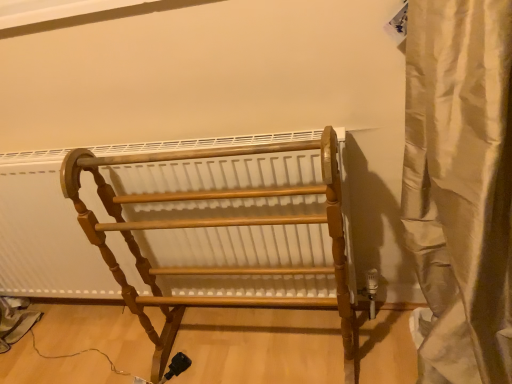
Question: From a real-world perspective, is beige satin curtain at right positioned under wooden towel rack at center based on gravity?

Choices:
 (A) no
 (B) yes

Answer: (A)

Question: Is the depth of beige satin curtain at right greater than that of wooden towel rack at center?

Choices:
 (A) no
 (B) yes

Answer: (A)

Question: Is beige satin curtain at right beside wooden towel rack at center?

Choices:
 (A) no
 (B) yes

Answer: (A)

Question: Is beige satin curtain at right not within wooden towel rack at center?

Choices:
 (A) yes
 (B) no

Answer: (A)

Question: Can you confirm if beige satin curtain at right is wider than wooden towel rack at center?

Choices:
 (A) yes
 (B) no

Answer: (A)

Question: Is beige satin curtain at right oriented towards wooden towel rack at center?

Choices:
 (A) no
 (B) yes

Answer: (A)

Question: Considering the relative sizes of wooden towel rack at center and beige satin curtain at right in the image provided, is wooden towel rack at center thinner than beige satin curtain at right?

Choices:
 (A) no
 (B) yes

Answer: (B)

Question: Is wooden towel rack at center behind beige satin curtain at right?

Choices:
 (A) yes
 (B) no

Answer: (A)

Question: Are wooden towel rack at center and beige satin curtain at right located far from each other?

Choices:
 (A) yes
 (B) no

Answer: (B)

Question: Can you confirm if wooden towel rack at center is wider than beige satin curtain at right?

Choices:
 (A) yes
 (B) no

Answer: (B)

Question: From the image's perspective, is wooden towel rack at center beneath beige satin curtain at right?

Choices:
 (A) yes
 (B) no

Answer: (A)

Question: From a real-world perspective, is wooden towel rack at center physically above beige satin curtain at right?

Choices:
 (A) no
 (B) yes

Answer: (A)

Question: Considering the positions of beige satin curtain at right and wooden towel rack at center in the image, is beige satin curtain at right bigger or smaller than wooden towel rack at center?

Choices:
 (A) small
 (B) big

Answer: (A)